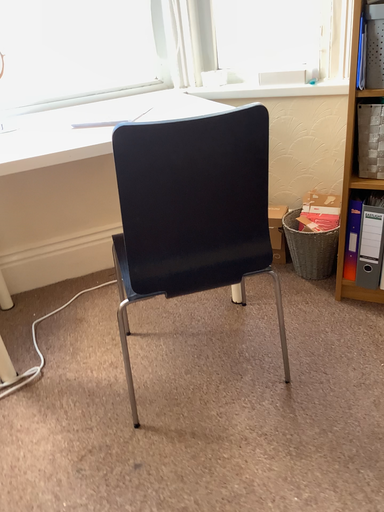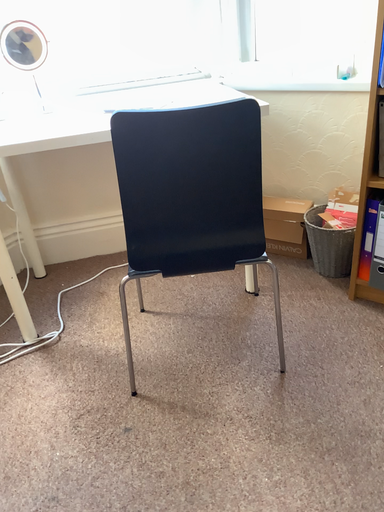
Question: Which way did the camera rotate in the video?

Choices:
 (A) rotated left
 (B) rotated right

Answer: (A)